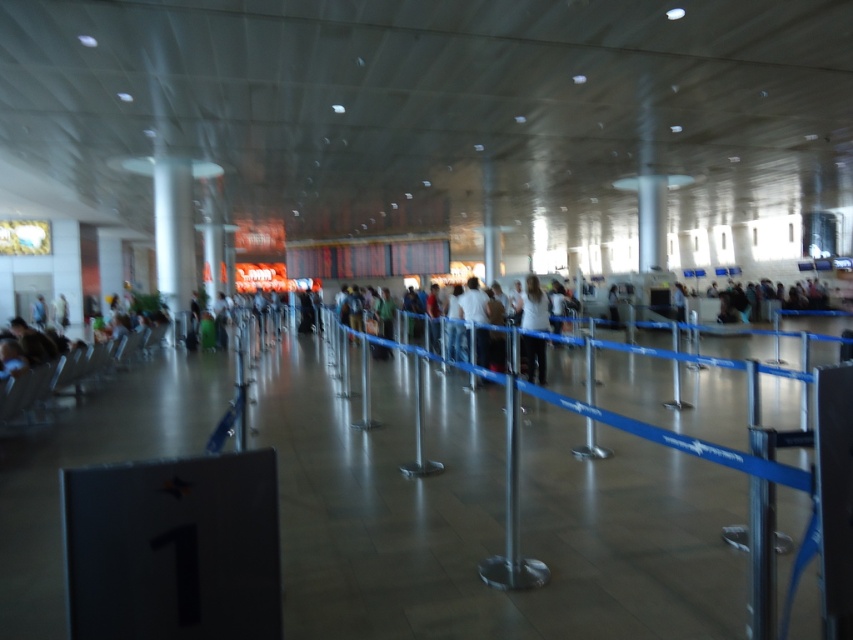
Question: Which of the following is the farthest from the observer?

Choices:
 (A) white matte shirt at center
 (B) blue rubber barrier at center

Answer: (A)

Question: Does blue rubber barrier at center have a smaller size compared to white shirt at center?

Choices:
 (A) yes
 (B) no

Answer: (A)

Question: Which of the following is the farthest from the observer?

Choices:
 (A) pyautogui.click(x=486, y=348)
 (B) pyautogui.click(x=538, y=308)
 (C) pyautogui.click(x=619, y=628)

Answer: (A)

Question: Is white matte shirt at center above white shirt at center?

Choices:
 (A) no
 (B) yes

Answer: (A)

Question: Which point is closer to the camera taking this photo?

Choices:
 (A) (524, 320)
 (B) (474, 342)

Answer: (A)

Question: Is blue rubber barrier at center positioned before white shirt at center?

Choices:
 (A) no
 (B) yes

Answer: (B)